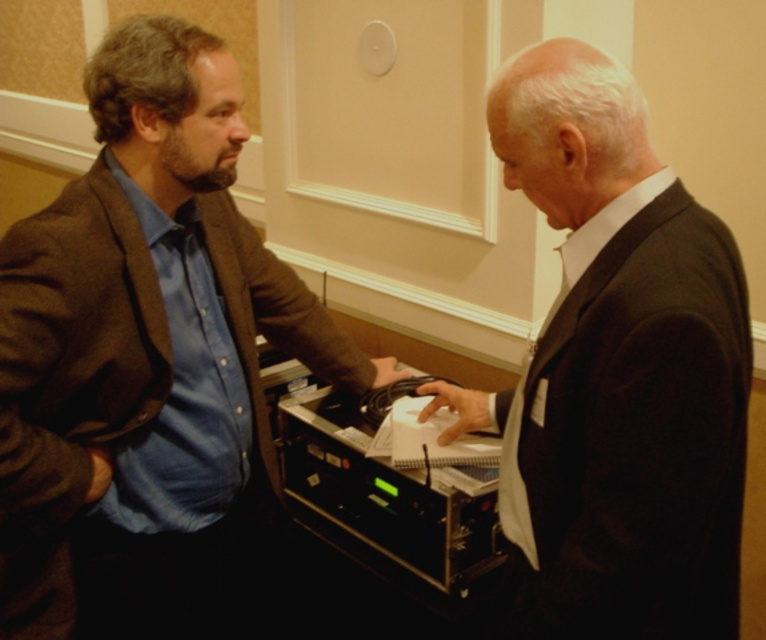
Does brown woolen jacket at left come in front of dark suit at right?

No, brown woolen jacket at left is further to the viewer.

Does brown woolen jacket at left have a larger size compared to dark suit at right?

Correct, brown woolen jacket at left is larger in size than dark suit at right.

Between point (87, 404) and point (552, 312), which one is positioned behind?

Positioned behind is point (87, 404).

Locate an element on the screen. The image size is (766, 640). brown woolen jacket at left is located at coordinates (146, 358).